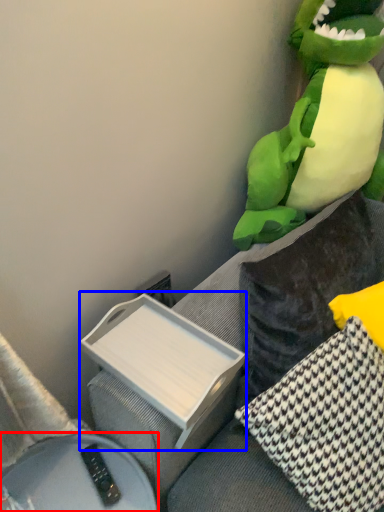
Question: Which object appears farthest to the camera in this image, furniture (highlighted by a red box) or box (highlighted by a blue box)?

Choices:
 (A) furniture
 (B) box

Answer: (B)